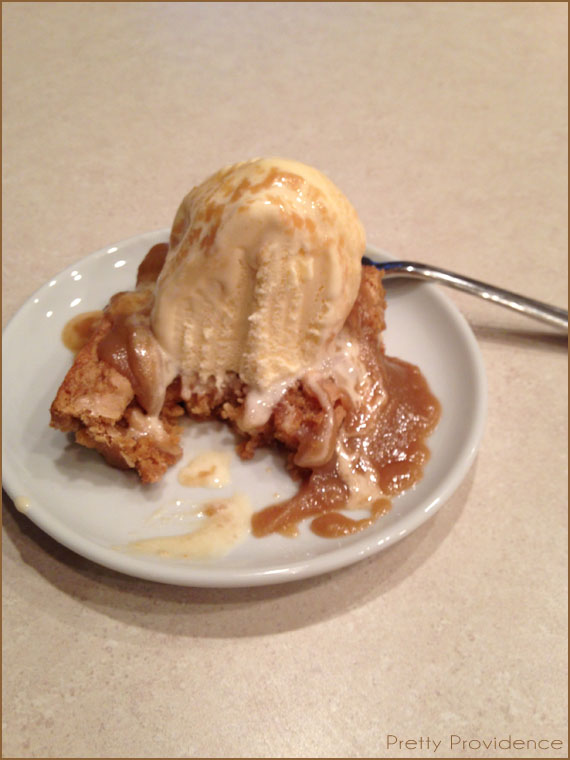
The image size is (570, 760). Identify the location of small white plate. (117, 508).